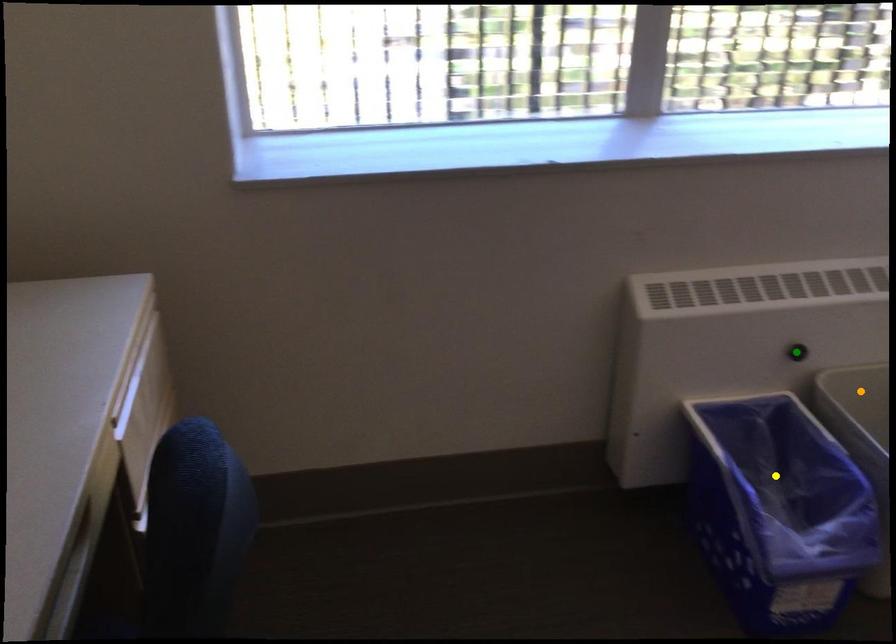
Order these from nearest to farthest:
green point
yellow point
orange point

yellow point < green point < orange point